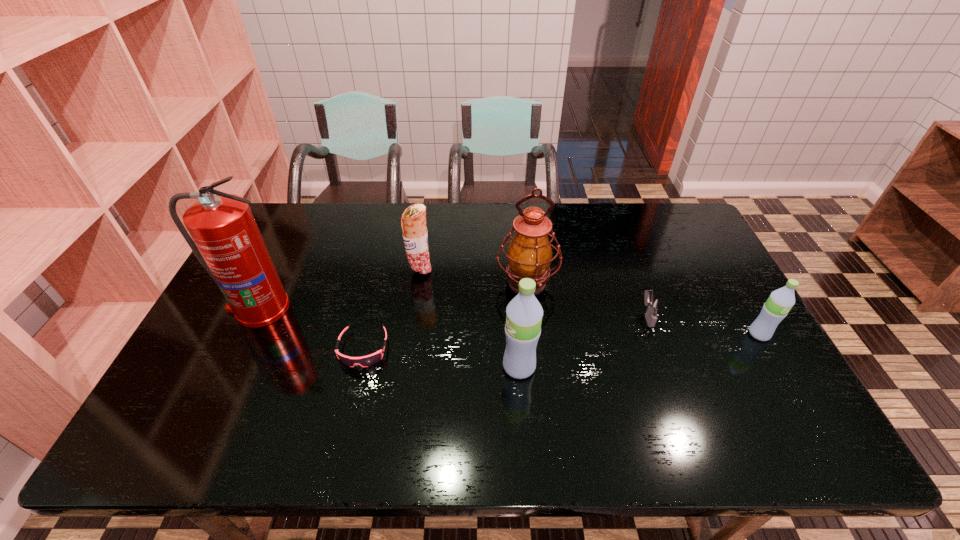
This screenshot has width=960, height=540. Find the location of `igniter`. igniter is located at coordinates pos(654,304).

Identify the location of the sixth object from left to right. (654, 304).

Image resolution: width=960 pixels, height=540 pixels. Identify the location of oil lamp. (529, 255).

Where is `free space located on the left of the nearer water bottle`? free space located on the left of the nearer water bottle is located at coordinates (347, 367).

You are a GUI agent. You are given a task and a screenshot of the screen. Output one action in this format:
    pyautogui.click(x=<x>, y=<y>)
    Task: Click on the free space located 0.110m on the front of the farther water bottle
    The height and width of the screenshot is (540, 960).
    Given the screenshot: What is the action you would take?
    pyautogui.click(x=784, y=377)

Where is `vacant region located on the front of the fourth tallest object`? The width and height of the screenshot is (960, 540). vacant region located on the front of the fourth tallest object is located at coordinates (413, 324).

I want to click on vacant space located on the instruction side of the tallest object, so click(210, 410).

At what (x,y) coordinates should I click in order to perform the action: click on vacant point located 0.060m on the front-facing side of the goggles. Please return your answer as a coordinate pair (x, y). The height and width of the screenshot is (540, 960). Looking at the image, I should click on (353, 390).

Find the location of a particular element. vacant space located 0.250m on the right of the sixth object from left to right is located at coordinates (744, 315).

The height and width of the screenshot is (540, 960). Identify the location of blank space located 0.050m on the right of the oil lamp. (575, 282).